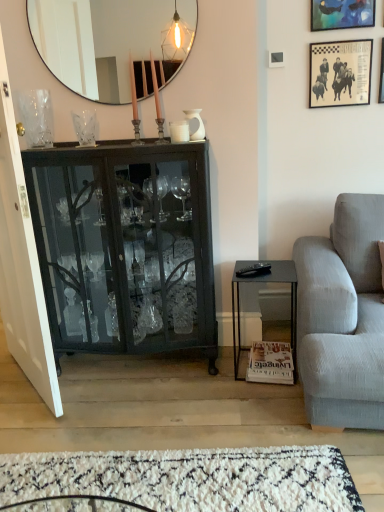
Find the location of a particular element. free space to the left of white matte coffee cup at center is located at coordinates (147, 147).